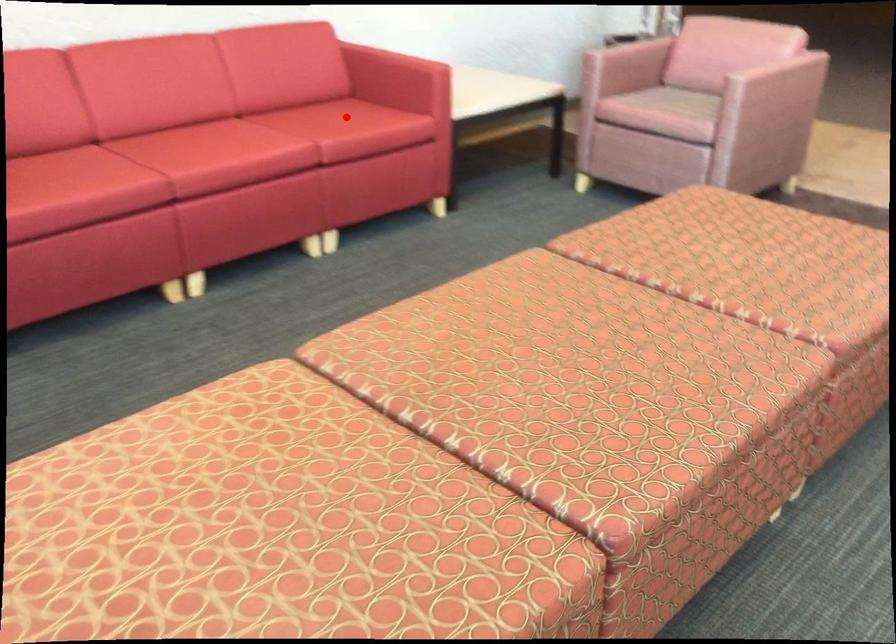
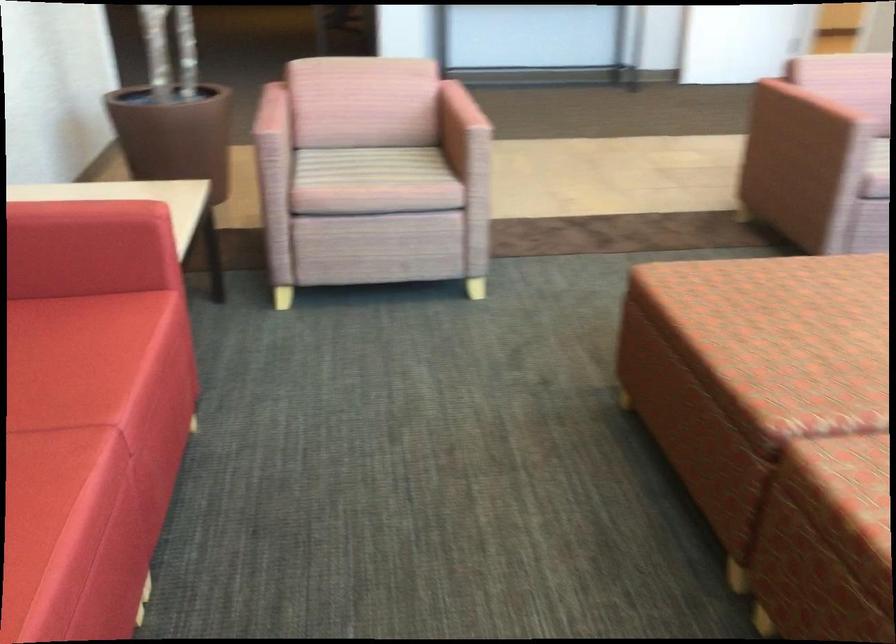
Question: A red point is marked in image1. In image2, is the corresponding 3D point closer to the camera or farther? Reply with the corresponding letter.

Choices:
 (A) The corresponding 3D point is closer.
 (B) The corresponding 3D point is farther.

Answer: (A)